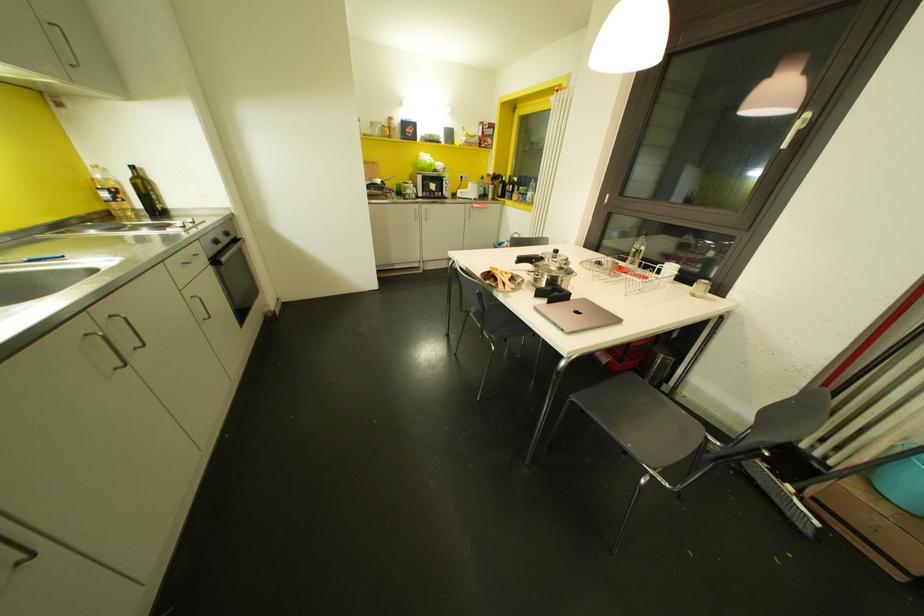
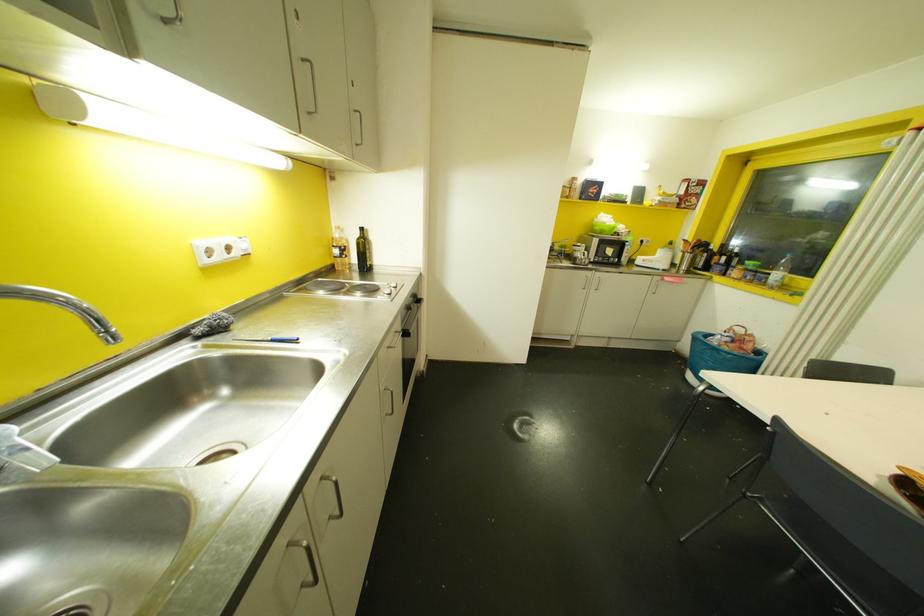
Find the pixel in the second image that matches point (215, 241) in the first image.

(407, 307)